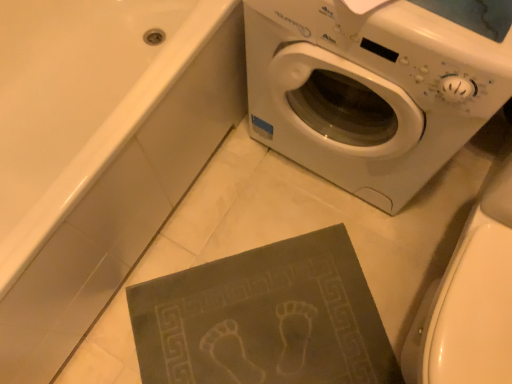
Question: Is point (477, 309) positioned closer to the camera than point (200, 364)?

Choices:
 (A) farther
 (B) closer

Answer: (B)

Question: Considering the positions of white glossy toilet bowl at lower right and dark gray textured mat at lower center in the image, is white glossy toilet bowl at lower right wider or thinner than dark gray textured mat at lower center?

Choices:
 (A) thin
 (B) wide

Answer: (A)

Question: Considering the real-world distances, which object is closest to the dark gray textured mat at lower center?

Choices:
 (A) white plastic washing machine at upper right
 (B) white glossy toilet bowl at lower right
 (C) matte gray bath mat at lower center

Answer: (B)

Question: Estimate the real-world distances between objects in this image. Which object is farther from the white plastic washing machine at upper right?

Choices:
 (A) white glossy toilet bowl at lower right
 (B) dark gray textured mat at lower center
 (C) matte gray bath mat at lower center

Answer: (B)